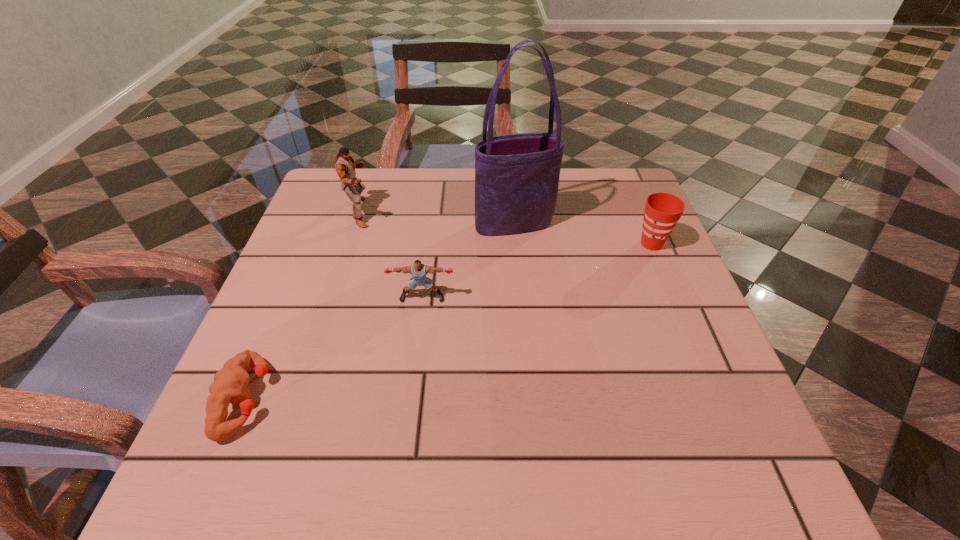
In the image, there is a desktop. At what (x,y) coordinates should I click in order to perform the action: click on free space at the far edge. Please return your answer as a coordinate pair (x, y). The image size is (960, 540). Looking at the image, I should click on (430, 168).

The height and width of the screenshot is (540, 960). In the image, there is a desktop. Identify the location of vacant space at the near edge. (425, 448).

You are a GUI agent. You are given a task and a screenshot of the screen. Output one action in this format:
    pyautogui.click(x=<x>, y=<y>)
    Task: Click on the free space at the left edge
    This screenshot has height=540, width=960.
    Given the screenshot: What is the action you would take?
    pyautogui.click(x=262, y=354)

The width and height of the screenshot is (960, 540). Identify the location of free space at the right edge of the desktop. (708, 332).

Find the location of a particular element. This screenshot has height=540, width=960. free space at the far right corner of the desktop is located at coordinates (593, 214).

This screenshot has height=540, width=960. I want to click on vacant space in between the second farthest puncher and the tote bag, so click(468, 261).

Where is `unoccupied area between the tallest object and the nearest object`? The height and width of the screenshot is (540, 960). unoccupied area between the tallest object and the nearest object is located at coordinates (380, 311).

Find the location of `unoccupied position between the tallest object and the cup`. unoccupied position between the tallest object and the cup is located at coordinates (583, 234).

This screenshot has width=960, height=540. I want to click on free area in between the second object from right to left and the nearest puncher, so click(x=380, y=311).

Identify the location of empty space that is in between the second shortest puncher and the rightmost object. (537, 271).